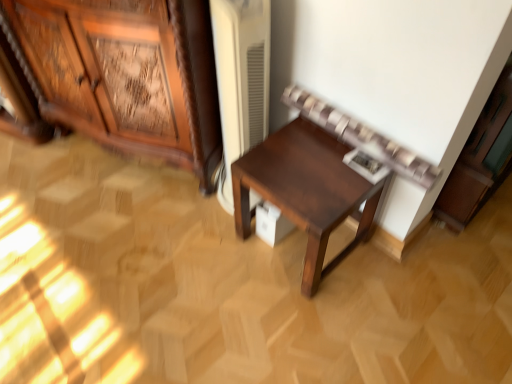
The width and height of the screenshot is (512, 384). Find the location of `vacant space situated above dark wood table at center (from a real-world perspective)`. vacant space situated above dark wood table at center (from a real-world perspective) is located at coordinates (315, 165).